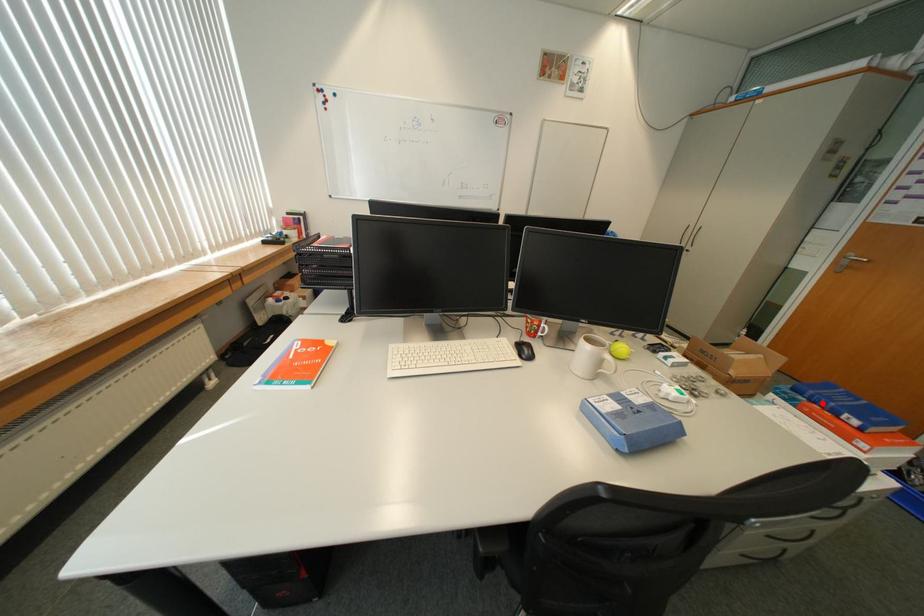
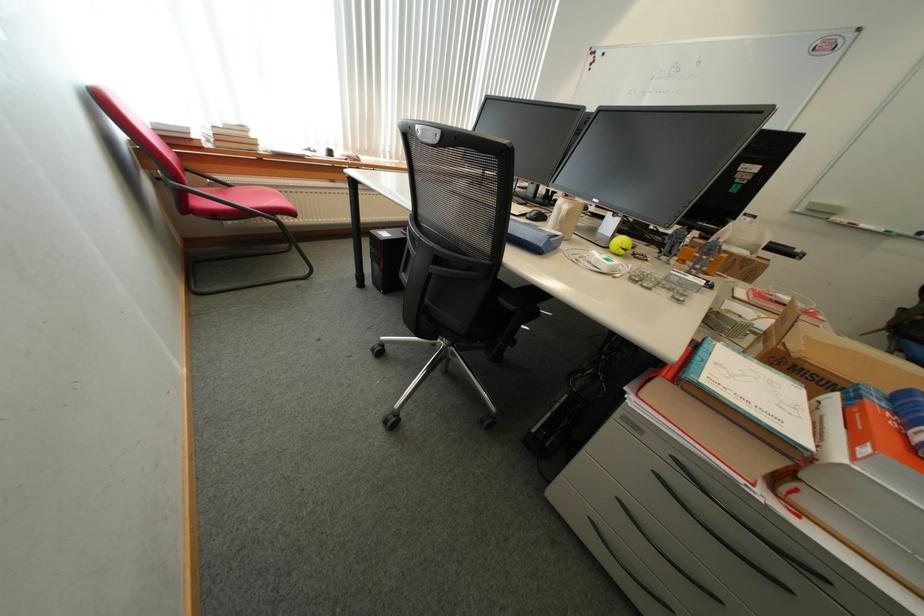
Question: I am providing you with two images of the same scene from different viewpoints. A red point is marked on the first image. At the location where the point appears in image 1, is it still visible in image 2?

Choices:
 (A) Yes
 (B) No

Answer: (A)